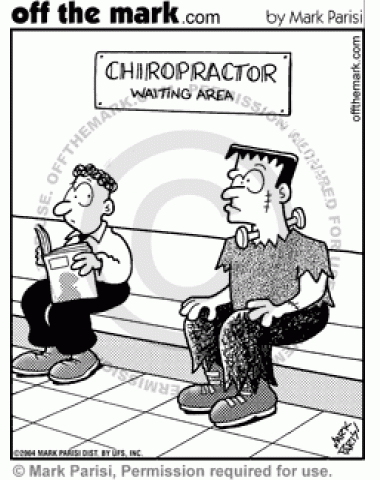
The width and height of the screenshot is (380, 480). Identify the location of magazine. (52, 279).